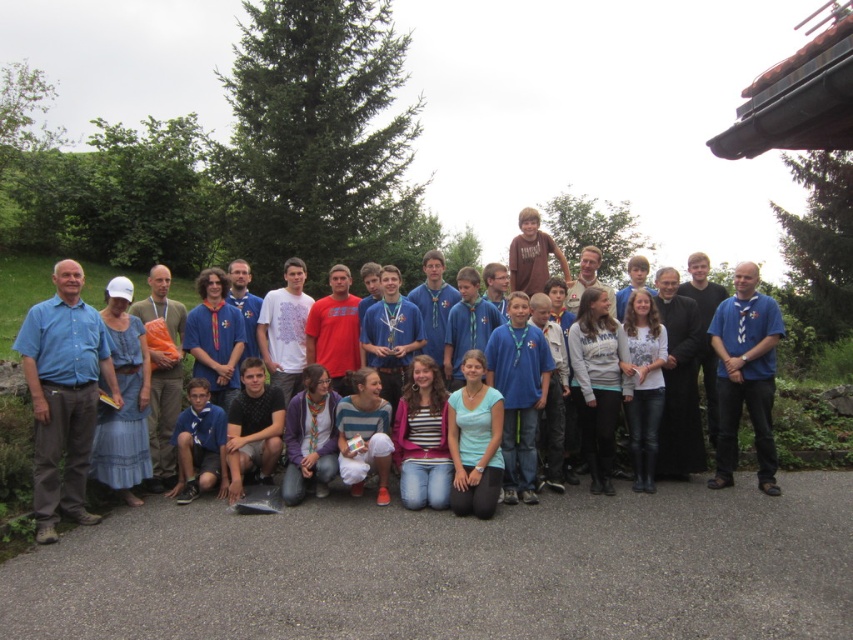
You are a photographer trying to adjust the focus of your camera. You notice two clothing items in the frame. The blue cotton dress at left and the light blue cotton shirt at center. Which clothing item is taller in the image?

The blue cotton dress at left is taller than the light blue cotton shirt at center.

You are organizing a group photo and need to arrange two people wearing blue clothing on the left side. The blue cotton dress at left and the matte blue shirt at left are both available. Which of these two should be placed on the leftmost position to ensure they are closer to the center of the group photo?

The blue cotton dress at left should be placed on the leftmost position because its width is less than the matte blue shirt at left, allowing it to occupy less space and be closer to the center.